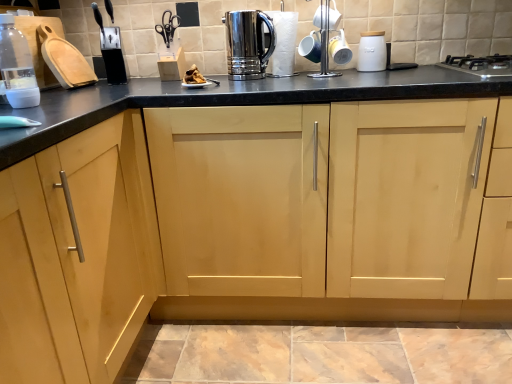
Question: In terms of size, does white matte bottle at left appear bigger or smaller than black plastic knife block at upper left, the 4th appliance viewed from the right?

Choices:
 (A) big
 (B) small

Answer: (B)

Question: From the image's perspective, is white matte bottle at left positioned above or below black plastic knife block at upper left, the first appliance from the left?

Choices:
 (A) above
 (B) below

Answer: (B)

Question: Estimate the real-world distances between objects in this image. Which object is closer to the polished stainless steel coffee pot at upper center, the 3th appliance in the right-to-left sequence?

Choices:
 (A) white matte bottle at left
 (B) polished stainless steel kettle at center
 (C) black stainless steel gas stove at upper right
 (D) natural wood cabinet at center
 (E) white ceramic jar at upper right, which is counted as the 1th appliance, starting from the right

Answer: (B)

Question: Which object is the closest to the white ceramic jar at upper right, positioned as the fourth appliance in left-to-right order?

Choices:
 (A) black plastic knife block at upper left, the first appliance from the left
 (B) black stainless steel gas stove at upper right
 (C) polished stainless steel kettle at center
 (D) polished stainless steel coffee pot at upper center, the 3th appliance in the right-to-left sequence
 (E) white matte bottle at left

Answer: (D)